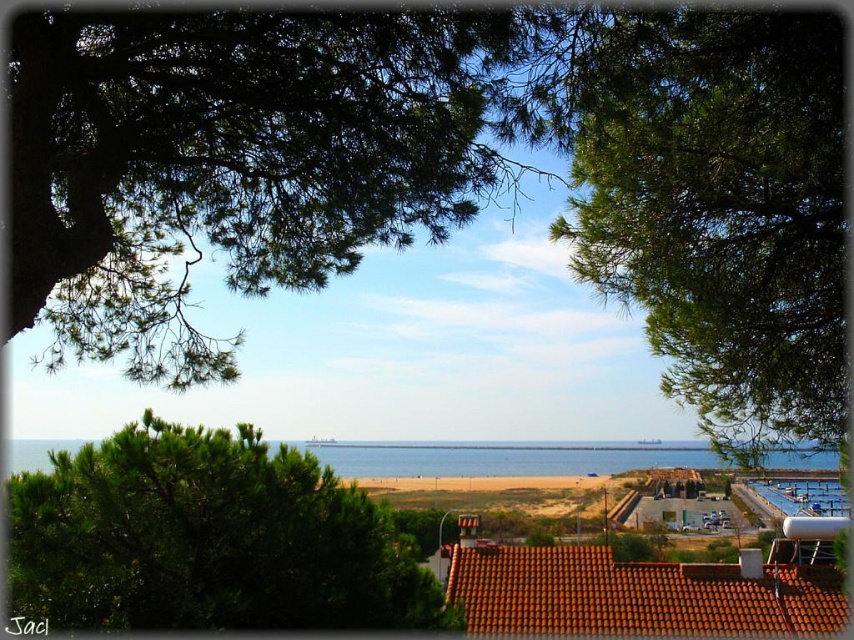
Question: Which object is the closest to the blue water at center?

Choices:
 (A) green needle-like leaves at upper center
 (B) green leafy tree at upper center

Answer: (B)

Question: Does green needle-like leaves at upper center appear on the right side of blue water at center?

Choices:
 (A) no
 (B) yes

Answer: (A)

Question: Can you confirm if green leafy tree at center is wider than blue water at center?

Choices:
 (A) no
 (B) yes

Answer: (A)

Question: Is the position of green leafy tree at upper center more distant than that of green leafy tree at center?

Choices:
 (A) yes
 (B) no

Answer: (B)

Question: Among these objects, which one is farthest from the camera?

Choices:
 (A) green leafy tree at upper center
 (B) blue water at center

Answer: (B)

Question: Among these points, which one is farthest from the camera?

Choices:
 (A) (711, 464)
 (B) (682, 282)
 (C) (144, 260)

Answer: (A)